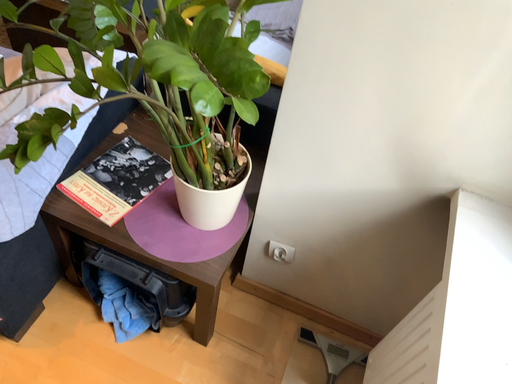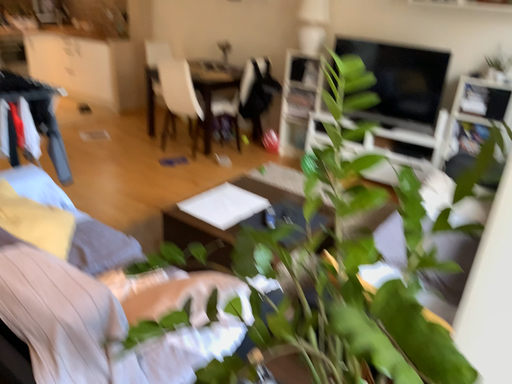
Question: How did the camera likely rotate when shooting the video?

Choices:
 (A) rotated left
 (B) rotated right

Answer: (A)